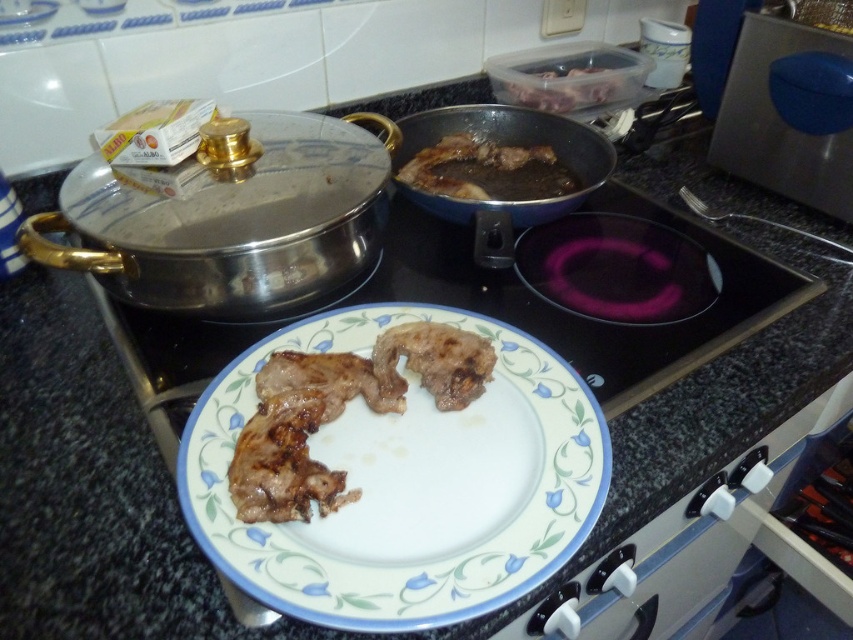
Looking at this image, you are a chef preparing a dish and need to place the satin silver fork at right onto the white ceramic plate at center. Will the fork fit entirely on the plate?

The white ceramic plate at center might be wider than satin silver fork at right, so there is a possibility that the fork will fit, but it is uncertain without exact measurements.

Please provide the 2D coordinates of the shiny metallic frying pan at upper left in the kitchen scene described.

The shiny metallic frying pan at upper left is located at coordinates point [231,216].

You are a chef preparing a dish and need to know which item is taller between the shiny metallic frying pan at upper left and the brown glossy meat at center. Can you determine which is taller?

The shiny metallic frying pan at upper left is taller than the brown glossy meat at center according to the description provided.